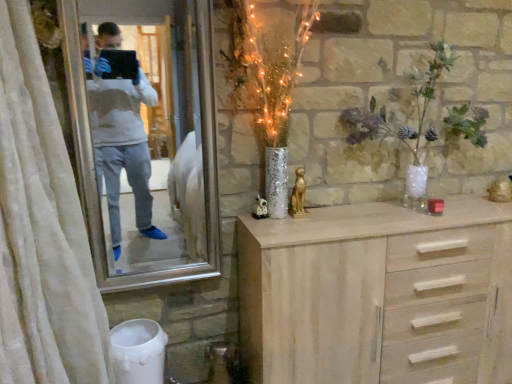
Describe the element at coordinates (149, 130) in the screenshot. I see `silver metallic mirror at upper left` at that location.

Looking at this image, what is the approximate height of translucent glass vase at upper right?

translucent glass vase at upper right is 28.27 inches tall.

You are a GUI agent. You are given a task and a screenshot of the screen. Output one action in this format:
    pyautogui.click(x=<x>, y=<y>)
    Task: Click on the white textured curtain at left
    The height and width of the screenshot is (384, 512).
    Given the screenshot: What is the action you would take?
    pyautogui.click(x=42, y=230)

Identify the location of floral arrangement behind the silver metallic mirror at upper left. This screenshot has width=512, height=384. (415, 105).

Considering the sizes of objects silver metallic mirror at upper left and translucent glass vase at upper right in the image provided, who is shorter, silver metallic mirror at upper left or translucent glass vase at upper right?

Standing shorter between the two is translucent glass vase at upper right.

From the image's perspective, which is below, silver metallic mirror at upper left or translucent glass vase at upper right?

silver metallic mirror at upper left is shown below in the image.

Considering the sizes of objects translucent glass vase at upper right and light wood chest of drawers at center in the image provided, who is taller, translucent glass vase at upper right or light wood chest of drawers at center?

With more height is light wood chest of drawers at center.

Is translucent glass vase at upper right oriented towards light wood chest of drawers at center?

No, translucent glass vase at upper right is not facing towards light wood chest of drawers at center.

At what (x,y) coordinates should I click in order to perform the action: click on the chest of drawers directly beneath the translucent glass vase at upper right (from a real-world perspective). Please return your answer as a coordinate pair (x, y). This screenshot has width=512, height=384. Looking at the image, I should click on (x=378, y=295).

Is the surface of light wood chest of drawers at center in direct contact with silver metallic mirror at upper left?

No, light wood chest of drawers at center is not touching silver metallic mirror at upper left.

This screenshot has width=512, height=384. Find the location of `mirror lying above the light wood chest of drawers at center (from the image's perspective)`. mirror lying above the light wood chest of drawers at center (from the image's perspective) is located at coordinates (149, 130).

Is light wood chest of drawers at center taller than silver metallic mirror at upper left?

Incorrect, the height of light wood chest of drawers at center is not larger of that of silver metallic mirror at upper left.

Is light wood chest of drawers at center oriented away from silver metallic mirror at upper left?

No, light wood chest of drawers at center's orientation is not away from silver metallic mirror at upper left.

Does white textured curtain at left have a larger size compared to light wood chest of drawers at center?

Yes, white textured curtain at left is bigger than light wood chest of drawers at center.

Does white textured curtain at left appear on the left side of light wood chest of drawers at center?

Yes.

I want to click on the chest of drawers behind the white textured curtain at left, so 378,295.

From the image's perspective, who appears lower, white textured curtain at left or light wood chest of drawers at center?

light wood chest of drawers at center appears lower in the image.

From the picture: Considering the sizes of objects light wood chest of drawers at center and translucent glass vase at upper right in the image provided, who is wider, light wood chest of drawers at center or translucent glass vase at upper right?

With larger width is light wood chest of drawers at center.

Is light wood chest of drawers at center taller than translucent glass vase at upper right?

Indeed, light wood chest of drawers at center has a greater height compared to translucent glass vase at upper right.

Is light wood chest of drawers at center to the left of translucent glass vase at upper right from the viewer's perspective?

Indeed, light wood chest of drawers at center is positioned on the left side of translucent glass vase at upper right.

Between light wood chest of drawers at center and translucent glass vase at upper right, which one has larger size?

light wood chest of drawers at center is bigger.

Is light wood chest of drawers at center looking in the opposite direction of white textured curtain at left?

No, white textured curtain at left is not at the back of light wood chest of drawers at center.

Considering the relative sizes of light wood chest of drawers at center and white textured curtain at left in the image provided, is light wood chest of drawers at center shorter than white textured curtain at left?

Correct, light wood chest of drawers at center is not as tall as white textured curtain at left.

Consider the image. What's the angular difference between light wood chest of drawers at center and white textured curtain at left's facing directions?

89.2 degrees separate the facing orientations of light wood chest of drawers at center and white textured curtain at left.

Between light wood chest of drawers at center and white textured curtain at left, which one has smaller width?

light wood chest of drawers at center.

Relative to silver metallic mirror at upper left, is translucent glass vase at upper right in front or behind?

In the image, translucent glass vase at upper right appears behind silver metallic mirror at upper left.

Does translucent glass vase at upper right appear on the right side of silver metallic mirror at upper left?

Yes, translucent glass vase at upper right is to the right of silver metallic mirror at upper left.

The height and width of the screenshot is (384, 512). There is a silver metallic mirror at upper left. Find the location of `floral arrangement above it (from a real-world perspective)`. floral arrangement above it (from a real-world perspective) is located at coordinates (415, 105).

Does translucent glass vase at upper right turn towards silver metallic mirror at upper left?

No, translucent glass vase at upper right is not oriented towards silver metallic mirror at upper left.

In the image, there is a translucent glass vase at upper right. Where is `mirror below it (from the image's perspective)`? This screenshot has width=512, height=384. mirror below it (from the image's perspective) is located at coordinates (149, 130).

Find the location of a particular element. This screenshot has height=384, width=512. floral arrangement positioned vertically above the light wood chest of drawers at center (from a real-world perspective) is located at coordinates (415, 105).

Estimate the real-world distances between objects in this image. Which object is further from silver metallic mirror at upper left, white textured curtain at left or light wood chest of drawers at center?

light wood chest of drawers at center lies further to silver metallic mirror at upper left than the other object.

Looking at the image, which one is located further to translucent glass vase at upper right, light wood chest of drawers at center or white textured curtain at left?

Based on the image, white textured curtain at left appears to be further to translucent glass vase at upper right.

When comparing their distances from silver metallic mirror at upper left, does light wood chest of drawers at center or translucent glass vase at upper right seem further?

translucent glass vase at upper right is further to silver metallic mirror at upper left.

When comparing their distances from white textured curtain at left, does translucent glass vase at upper right or light wood chest of drawers at center seem closer?

light wood chest of drawers at center is closer to white textured curtain at left.

Based on their spatial positions, is translucent glass vase at upper right or light wood chest of drawers at center further from silver metallic mirror at upper left?

translucent glass vase at upper right is positioned further to the anchor silver metallic mirror at upper left.

When comparing their distances from white textured curtain at left, does silver metallic mirror at upper left or light wood chest of drawers at center seem further?

Among the two, silver metallic mirror at upper left is located further to white textured curtain at left.

Considering their positions, is light wood chest of drawers at center positioned closer to white textured curtain at left than translucent glass vase at upper right?

The object closer to white textured curtain at left is light wood chest of drawers at center.

Looking at the image, which one is located closer to light wood chest of drawers at center, silver metallic mirror at upper left or white textured curtain at left?

Based on the image, white textured curtain at left appears to be nearer to light wood chest of drawers at center.

Identify the location of chest of drawers between silver metallic mirror at upper left and translucent glass vase at upper right from left to right. The height and width of the screenshot is (384, 512). (378, 295).

The width and height of the screenshot is (512, 384). What are the coordinates of `chest of drawers between white textured curtain at left and translucent glass vase at upper right` in the screenshot? It's located at (378, 295).

The width and height of the screenshot is (512, 384). What are the coordinates of `mirror between white textured curtain at left and light wood chest of drawers at center from left to right` in the screenshot? It's located at (149, 130).

Where is `mirror located between white textured curtain at left and translucent glass vase at upper right in the left-right direction`? This screenshot has height=384, width=512. mirror located between white textured curtain at left and translucent glass vase at upper right in the left-right direction is located at coordinates (149, 130).